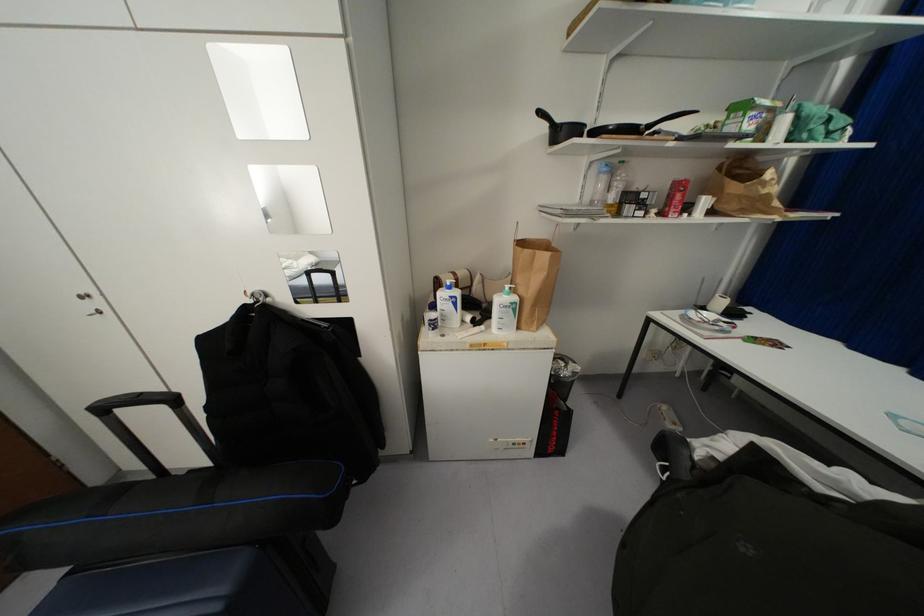
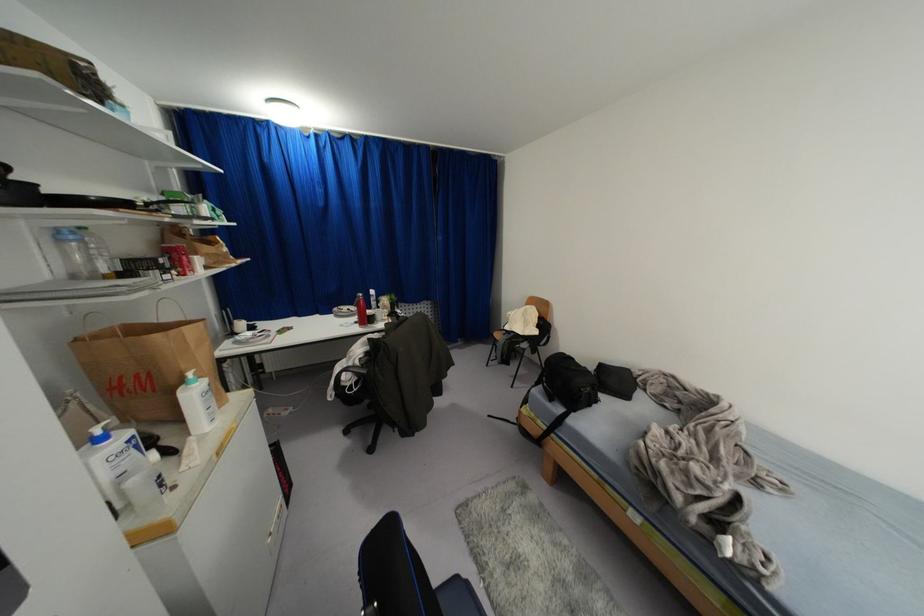
In the second image, find the point that corresponds to point 598,172 in the first image.

(62, 240)